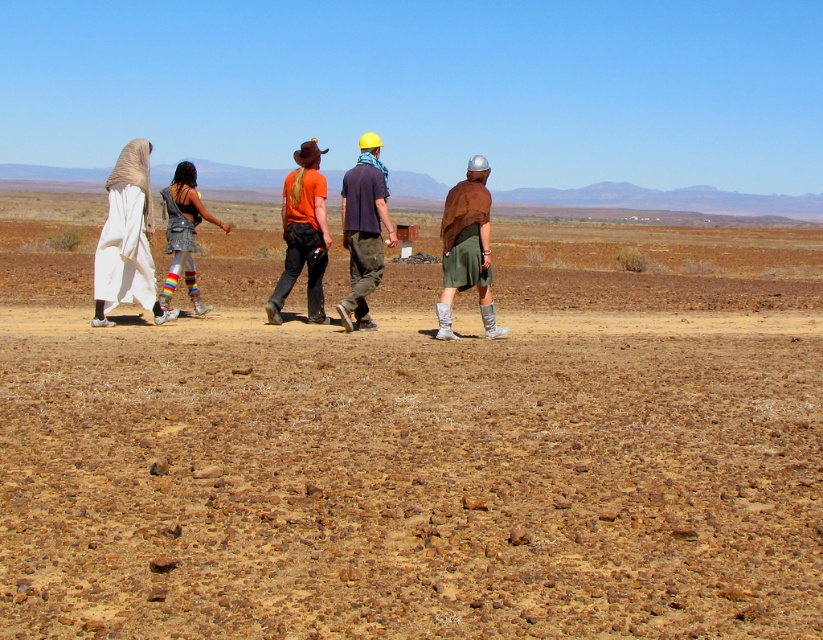
You are a photographer standing at the camera position. You want to capture a closeup of the white fabric headscarf at left without moving the camera. Is it possible to zoom in enough to get a clear closeup?

The white fabric headscarf at left is 9.12 meters away from camera, so yes, with proper zoom, it is possible to capture a clear closeup without moving the camera.

You are a photographer trying to capture a clear shot of the dark purple shirt at center without the white fabric headscarf at left blocking it. Based on their positions, is this possible?

The white fabric headscarf at left is positioned under the dark purple shirt at center, so it might block the view. To capture a clear shot of the dark purple shirt at center without the headscarf, adjust the camera angle slightly upward to avoid the headscarf.